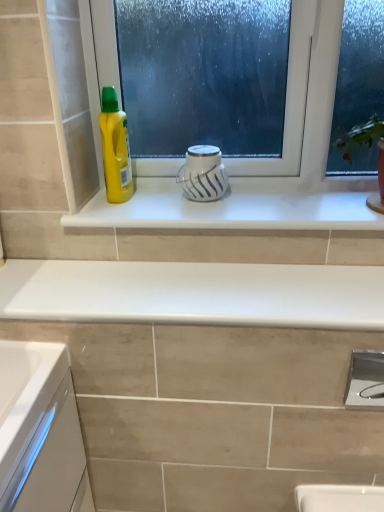
Locate an element on the screen. free space between yellow plastic bottle at left and white glossy mug at center is located at coordinates (155, 201).